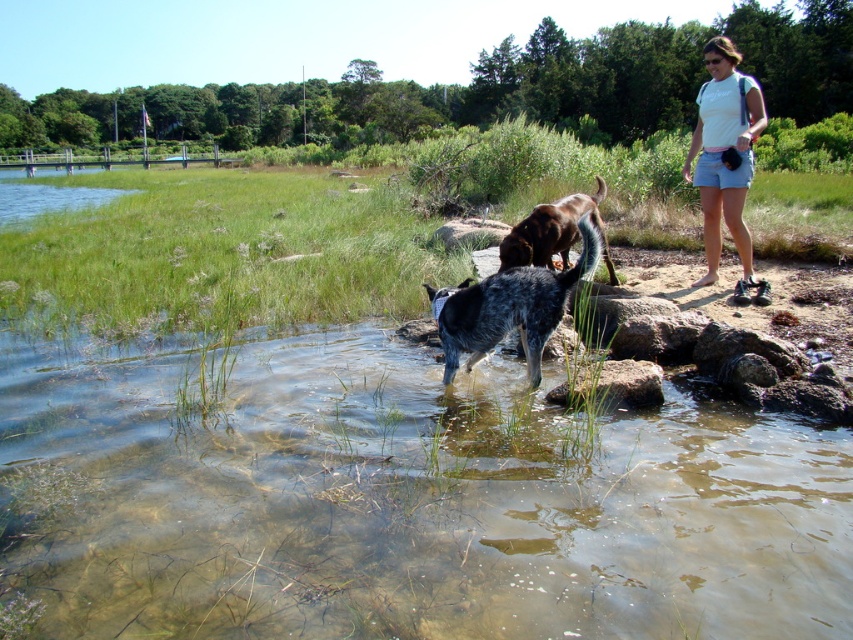
Question: Which point is closer to the camera?

Choices:
 (A) white cotton shirt at upper right
 (B) brown rough stone at center
 (C) smooth gray rock at lower center
 (D) brown fur dog at center

Answer: (C)

Question: Can you confirm if blue speckled fur at center is wider than brown fur dog at center?

Choices:
 (A) yes
 (B) no

Answer: (B)

Question: Considering the relative positions of blue speckled fur at center and smooth gray rock at lower center in the image provided, where is blue speckled fur at center located with respect to smooth gray rock at lower center?

Choices:
 (A) left
 (B) right

Answer: (A)

Question: Is white cotton shirt at upper right positioned before smooth gray rock at lower center?

Choices:
 (A) no
 (B) yes

Answer: (A)

Question: Considering the real-world distances, which object is farthest from the brown fur dog at center?

Choices:
 (A) brown rough stone at center
 (B) smooth gray rock at lower center
 (C) blue speckled fur at center
 (D) white cotton shirt at upper right

Answer: (A)

Question: Which object is positioned farthest from the white cotton shirt at upper right?

Choices:
 (A) blue speckled fur at center
 (B) brown fur dog at center

Answer: (A)